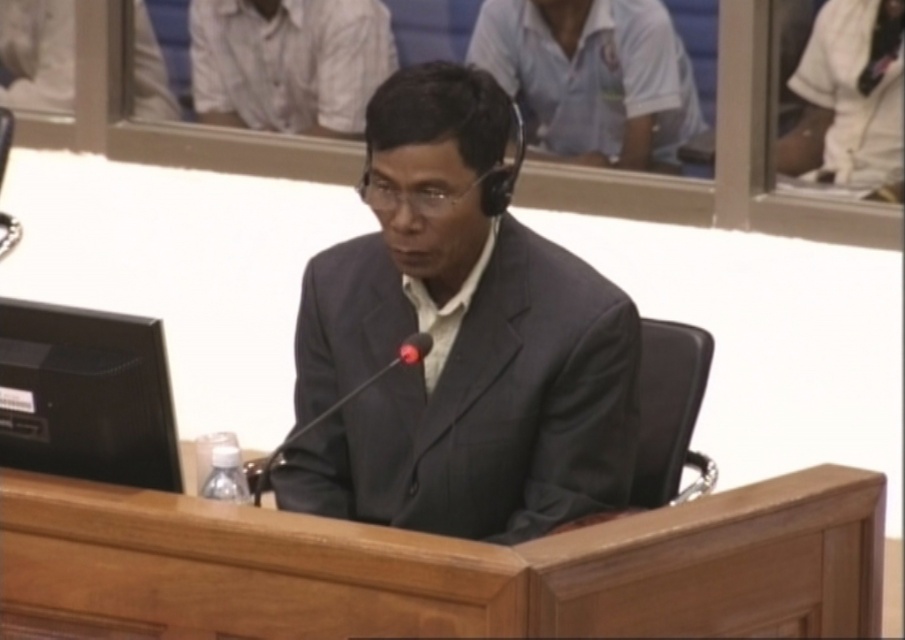
Is point (844, 536) in front of point (556, 348)?

Yes.

Who is positioned more to the right, wooden table at center or matte black suit at center?

wooden table at center is more to the right.

I want to click on wooden table at center, so click(x=440, y=566).

Find the location of a particular element. wooden table at center is located at coordinates (440, 566).

Who is shorter, matte black suit at center or white matte shirt at upper left?

With less height is white matte shirt at upper left.

Who is more forward, (492, 397) or (244, 116)?

Point (492, 397)

Image resolution: width=905 pixels, height=640 pixels. I want to click on matte black suit at center, so click(x=456, y=340).

Who is positioned more to the right, matte black suit at center or white matte shirt at upper center?

white matte shirt at upper center is more to the right.

Which is above, matte black suit at center or white matte shirt at upper center?

white matte shirt at upper center is higher up.

Between point (475, 387) and point (569, 84), which one is positioned behind?

Positioned behind is point (569, 84).

Locate an element on the screen. Image resolution: width=905 pixels, height=640 pixels. matte black suit at center is located at coordinates (456, 340).